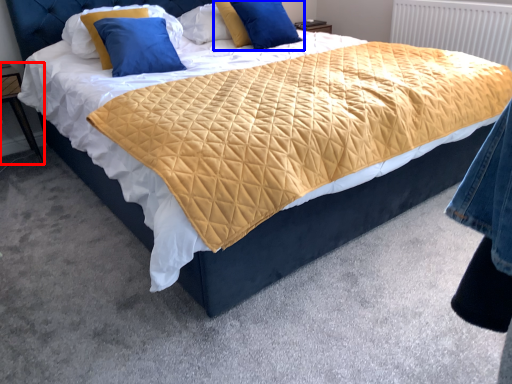
Question: Which point is further to the camera, nightstand (highlighted by a red box) or pillow (highlighted by a blue box)?

Choices:
 (A) nightstand
 (B) pillow

Answer: (B)